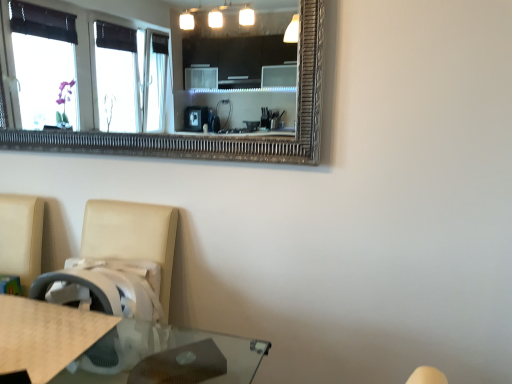
Identify the location of beige leather swivel chair at lower left. (118, 262).

What is the approximate height of beige leather swivel chair at lower left?

It is 32.88 inches.

The image size is (512, 384). What do you see at coordinates (118, 262) in the screenshot?
I see `beige leather swivel chair at lower left` at bounding box center [118, 262].

Measure the distance between beige textured mat at lower left and camera.

The depth of beige textured mat at lower left is 39.33 inches.

This screenshot has width=512, height=384. I want to click on beige textured mat at lower left, so click(x=45, y=335).

Image resolution: width=512 pixels, height=384 pixels. What do you see at coordinates (45, 335) in the screenshot? I see `beige textured mat at lower left` at bounding box center [45, 335].

Identify the location of beige leather swivel chair at lower left. (118, 262).

Considering the relative positions of beige textured mat at lower left and beige leather swivel chair at lower left in the image provided, is beige textured mat at lower left to the left or to the right of beige leather swivel chair at lower left?

Based on their positions, beige textured mat at lower left is located to the left of beige leather swivel chair at lower left.

Which is in front, beige textured mat at lower left or beige leather swivel chair at lower left?

Positioned in front is beige textured mat at lower left.

Considering the points (5, 295) and (106, 308), which point is behind, point (5, 295) or point (106, 308)?

The point (5, 295) is farther from the camera.

From the image's perspective, is beige textured mat at lower left on beige leather swivel chair at lower left?

Indeed, from the image's perspective, beige textured mat at lower left is shown above beige leather swivel chair at lower left.

From a real-world perspective, is beige textured mat at lower left beneath beige leather swivel chair at lower left?

No.

Between beige textured mat at lower left and beige leather swivel chair at lower left, which one has larger width?

beige leather swivel chair at lower left.

Can you confirm if beige textured mat at lower left is taller than beige leather swivel chair at lower left?

In fact, beige textured mat at lower left may be shorter than beige leather swivel chair at lower left.

Does beige textured mat at lower left have a larger size compared to beige leather swivel chair at lower left?

No, beige textured mat at lower left is not bigger than beige leather swivel chair at lower left.

Is beige textured mat at lower left not inside beige leather swivel chair at lower left?

No.

Is beige textured mat at lower left not close to beige leather swivel chair at lower left?

No, beige textured mat at lower left is not far away from beige leather swivel chair at lower left.

Is beige textured mat at lower left facing towards beige leather swivel chair at lower left?

Yes, beige textured mat at lower left is facing beige leather swivel chair at lower left.

Measure the distance from beige textured mat at lower left to beige leather swivel chair at lower left.

beige textured mat at lower left is 7.34 inches from beige leather swivel chair at lower left.

What are the coordinates of `counter top in front of the beige leather swivel chair at lower left` in the screenshot? It's located at (45, 335).

From the picture: Between beige leather swivel chair at lower left and beige textured mat at lower left, which one appears on the left side from the viewer's perspective?

Positioned to the left is beige textured mat at lower left.

Considering the positions of objects beige leather swivel chair at lower left and beige textured mat at lower left in the image provided, who is in front, beige leather swivel chair at lower left or beige textured mat at lower left?

beige textured mat at lower left.

Which point is more forward, (167,305) or (77,349)?

The point (77,349) is in front.

From the image's perspective, is beige leather swivel chair at lower left located beneath beige textured mat at lower left?

Yes.

From a real-world perspective, who is located lower, beige leather swivel chair at lower left or beige textured mat at lower left?

beige leather swivel chair at lower left is physically lower.

Looking at their sizes, would you say beige leather swivel chair at lower left is wider or thinner than beige textured mat at lower left?

Considering their sizes, beige leather swivel chair at lower left looks broader than beige textured mat at lower left.

Looking at this image, is beige leather swivel chair at lower left shorter than beige textured mat at lower left?

No.

Who is bigger, beige leather swivel chair at lower left or beige textured mat at lower left?

beige leather swivel chair at lower left is bigger.

Is beige textured mat at lower left surrounded by beige leather swivel chair at lower left?

Yes.

Is there a large distance between beige leather swivel chair at lower left and beige textured mat at lower left?

That's not correct — beige leather swivel chair at lower left is a little close to beige textured mat at lower left.

Is beige textured mat at lower left at the back of beige leather swivel chair at lower left?

No, beige leather swivel chair at lower left's orientation is not away from beige textured mat at lower left.

Measure the distance from beige leather swivel chair at lower left to beige textured mat at lower left.

beige leather swivel chair at lower left is 7.34 inches from beige textured mat at lower left.

At what (x,y) coordinates should I click in order to perform the action: click on swivel chair that is behind the beige textured mat at lower left. Please return your answer as a coordinate pair (x, y). Looking at the image, I should click on (118, 262).

This screenshot has width=512, height=384. Identify the location of swivel chair located behind the beige textured mat at lower left. (118, 262).

Locate an element on the screen. swivel chair below the beige textured mat at lower left (from a real-world perspective) is located at coordinates (118, 262).